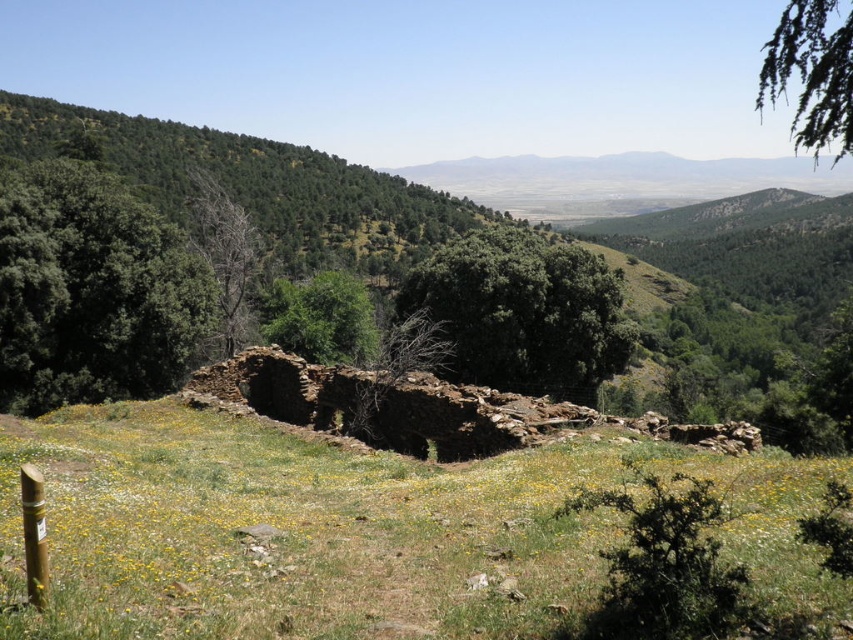
Describe the element at coordinates (91, 291) in the screenshot. I see `green leafy tree at left` at that location.

This screenshot has width=853, height=640. Find the location of `green leafy tree at left`. green leafy tree at left is located at coordinates 91,291.

Locate an element on the screen. The height and width of the screenshot is (640, 853). green leafy tree at left is located at coordinates (91, 291).

Which of these two, green textured branch at upper right or bare wood tree at center-left, stands taller?

green textured branch at upper right

Who is lower down, green textured branch at upper right or bare wood tree at center-left?

bare wood tree at center-left

Measure the distance between point [799,140] and camera.

Point [799,140] is 242.90 meters away from camera.

Find the location of a particular element. green textured branch at upper right is located at coordinates (811, 74).

Describe the element at coordinates (523, 314) in the screenshot. I see `green rough bark tree at center` at that location.

Which is in front, point (492, 368) or point (839, 154)?

Point (492, 368) is more forward.

Identify the location of green rough bark tree at center. This screenshot has height=640, width=853. (523, 314).